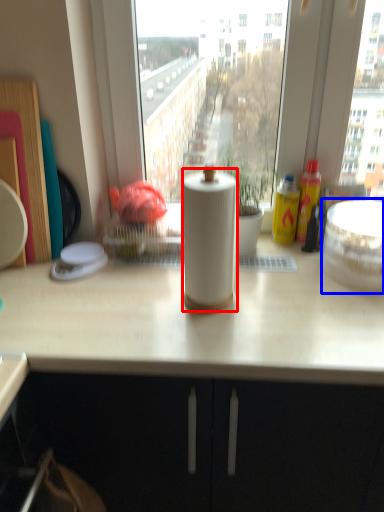
Question: Which of the following is the closest to the observer, paper towel (highlighted by a red box) or appliance (highlighted by a blue box)?

Choices:
 (A) paper towel
 (B) appliance

Answer: (A)